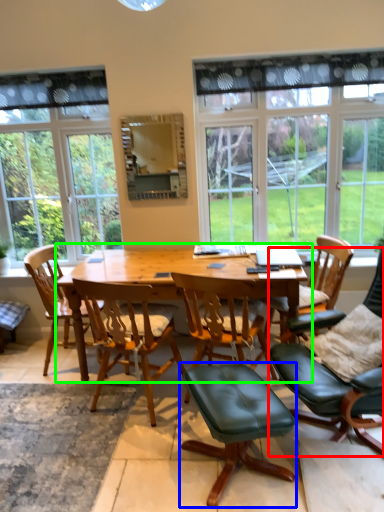
Question: Which object is the farthest from chair (highlighted by a red box)? Choose among these: stool (highlighted by a blue box) or kitchen & dining room table (highlighted by a green box).

Choices:
 (A) stool
 (B) kitchen & dining room table

Answer: (B)